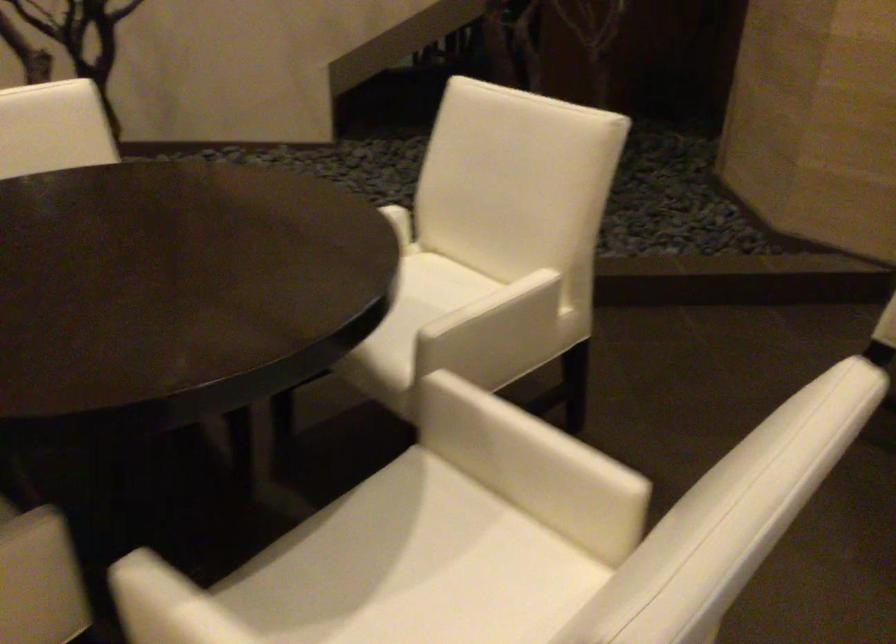
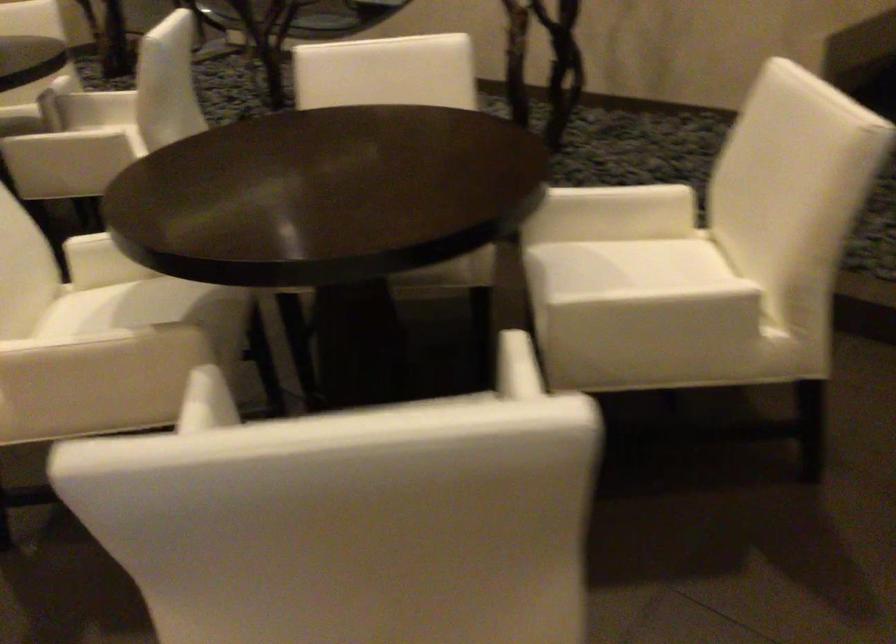
Question: How did the camera likely rotate?

Choices:
 (A) Left
 (B) Right
 (C) Up
 (D) Down

Answer: (A)